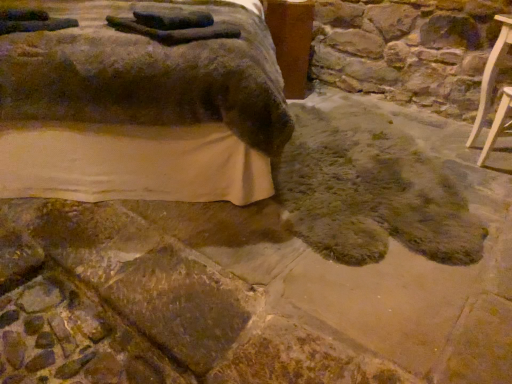
Question: Could brown textured mattress at lower left, acting as the first furniture starting from the left, be considered to be inside fuzzy brown rug at lower center?

Choices:
 (A) no
 (B) yes

Answer: (A)

Question: Considering the relative sizes of fuzzy brown rug at lower center and brown textured mattress at lower left, which is the 2th furniture from right to left, in the image provided, is fuzzy brown rug at lower center smaller than brown textured mattress at lower left, which is the 2th furniture from right to left,?

Choices:
 (A) no
 (B) yes

Answer: (B)

Question: Is fuzzy brown rug at lower center not near brown textured mattress at lower left, which is the 2th furniture from right to left?

Choices:
 (A) no
 (B) yes

Answer: (A)

Question: Does fuzzy brown rug at lower center have a larger size compared to brown textured mattress at lower left, acting as the first furniture starting from the left?

Choices:
 (A) yes
 (B) no

Answer: (B)

Question: Can you confirm if fuzzy brown rug at lower center is positioned to the right of brown textured mattress at lower left, acting as the first furniture starting from the left?

Choices:
 (A) yes
 (B) no

Answer: (A)

Question: Is brown textured mattress at lower left, which is the 2th furniture from right to left, taller or shorter than light wood chair at right, which is the second furniture in left-to-right order?

Choices:
 (A) tall
 (B) short

Answer: (A)

Question: Considering the positions of point (146, 142) and point (502, 127), is point (146, 142) closer or farther from the camera than point (502, 127)?

Choices:
 (A) closer
 (B) farther

Answer: (A)

Question: From the image's perspective, is brown textured mattress at lower left, acting as the first furniture starting from the left, positioned above or below light wood chair at right, which is the second furniture in left-to-right order?

Choices:
 (A) above
 (B) below

Answer: (A)

Question: Based on their positions, is brown textured mattress at lower left, which is the 2th furniture from right to left, located to the left or right of light wood chair at right, which is the second furniture in left-to-right order?

Choices:
 (A) left
 (B) right

Answer: (A)

Question: From a real-world perspective, is fuzzy brown rug at lower center positioned above or below brown wood table at upper center?

Choices:
 (A) below
 (B) above

Answer: (A)

Question: Is fuzzy brown rug at lower center inside the boundaries of brown wood table at upper center, or outside?

Choices:
 (A) inside
 (B) outside

Answer: (B)

Question: Looking at the image, does fuzzy brown rug at lower center seem bigger or smaller compared to brown wood table at upper center?

Choices:
 (A) big
 (B) small

Answer: (A)

Question: From their relative heights in the image, would you say fuzzy brown rug at lower center is taller or shorter than brown wood table at upper center?

Choices:
 (A) tall
 (B) short

Answer: (B)

Question: Is brown wood table at upper center taller or shorter than light wood chair at right, which is the second furniture in left-to-right order?

Choices:
 (A) short
 (B) tall

Answer: (B)

Question: Considering the positions of brown wood table at upper center and light wood chair at right, the 1th furniture when ordered from right to left, in the image, is brown wood table at upper center wider or thinner than light wood chair at right, the 1th furniture when ordered from right to left,?

Choices:
 (A) thin
 (B) wide

Answer: (B)